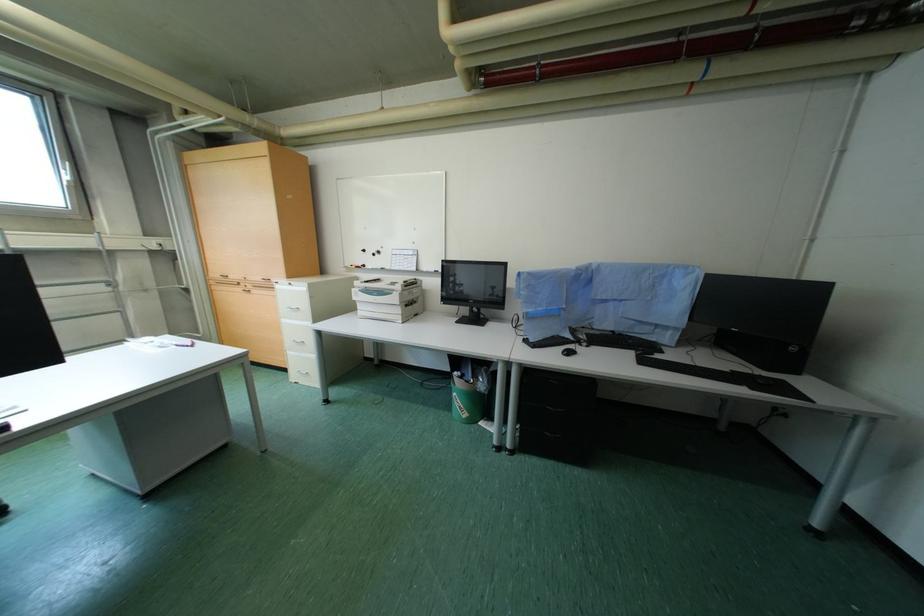
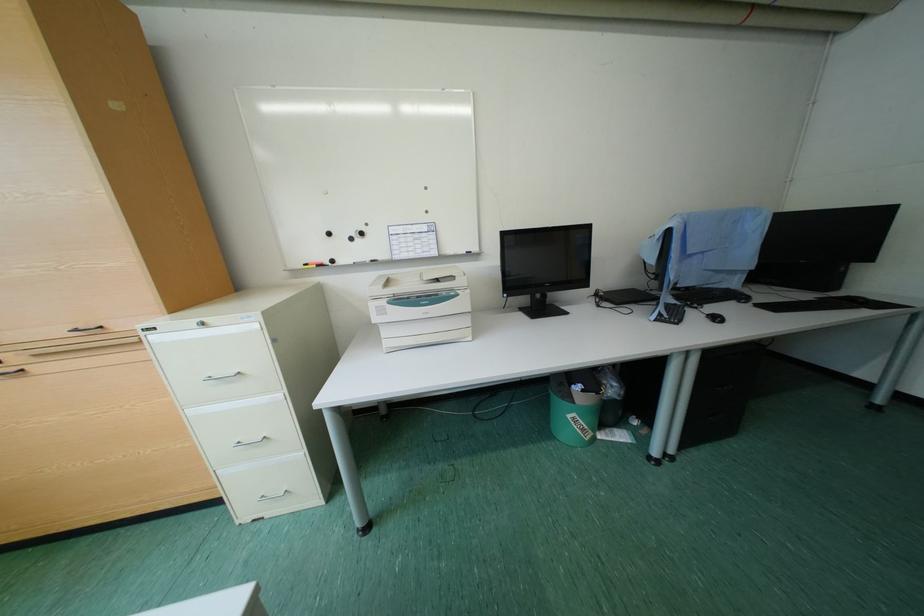
What movement of the cameraman would produce the second image?

The movement direction of the cameraman is left, forward.